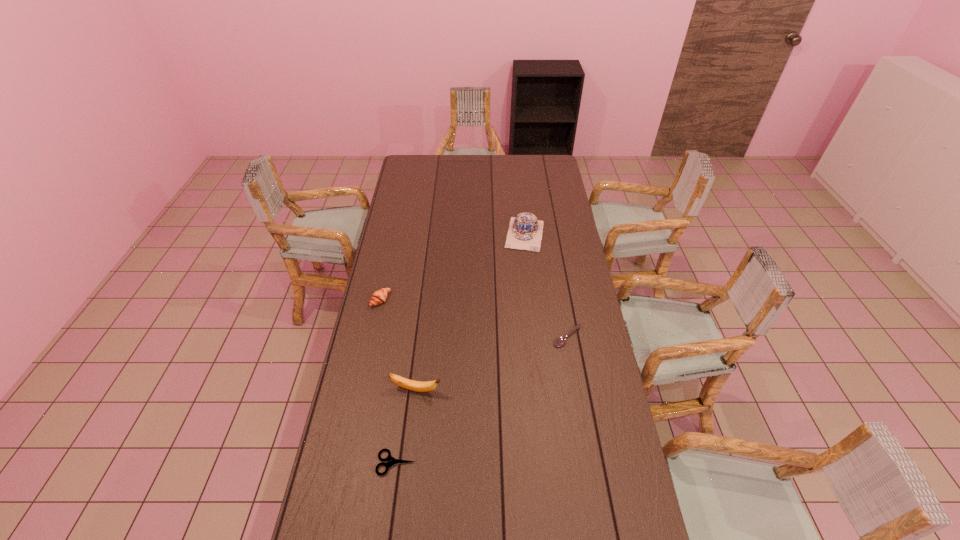
At what (x,y) coordinates should I click in order to perform the action: click on free space located at the stem of the second nearest object. Please return your answer as a coordinate pair (x, y). Image resolution: width=960 pixels, height=540 pixels. Looking at the image, I should click on (537, 407).

Where is `vacant region located at the stem of the second nearest object`? The height and width of the screenshot is (540, 960). vacant region located at the stem of the second nearest object is located at coordinates (501, 401).

The height and width of the screenshot is (540, 960). In order to click on free space located 0.320m at the stem of the second nearest object in this screenshot , I will do `click(534, 407)`.

Find the location of a particular element. vacant space situated on the front, side, and top of the cap is located at coordinates (516, 296).

The width and height of the screenshot is (960, 540). Identify the location of vacant space positioned 0.080m on the front, side, and top of the cap. (521, 264).

You are a GUI agent. You are given a task and a screenshot of the screen. Output one action in this format:
    pyautogui.click(x=<x>, y=<y>)
    Task: Click on the vacant space located 0.060m on the front, side, and top of the cap
    The height and width of the screenshot is (540, 960).
    Given the screenshot: What is the action you would take?
    pyautogui.click(x=521, y=261)

Find the location of `vacant region located 0.110m on the front-facing side of the leftmost object`. vacant region located 0.110m on the front-facing side of the leftmost object is located at coordinates (407, 317).

At what (x,y) coordinates should I click in order to perform the action: click on free space located 0.130m on the front-facing side of the leftmost object. Please return your answer as a coordinate pair (x, y). Image resolution: width=960 pixels, height=540 pixels. Looking at the image, I should click on pos(411,319).

At what (x,y) coordinates should I click in order to perform the action: click on vacant area situated 0.160m on the front-facing side of the leftmost object. Please return your answer as a coordinate pair (x, y). This screenshot has height=540, width=960. Looking at the image, I should click on (417, 322).

Identify the location of shears that is at the left edge. This screenshot has height=540, width=960. (391, 460).